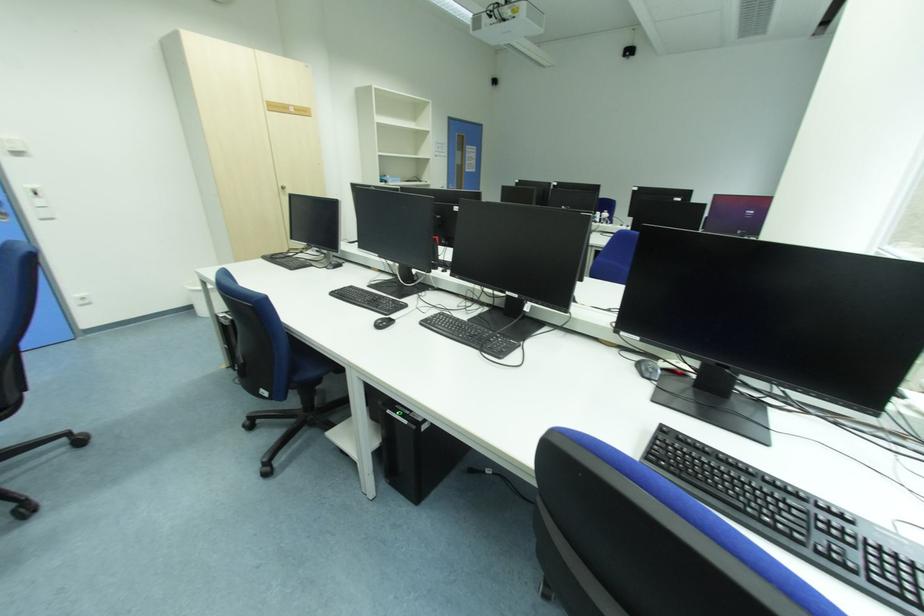
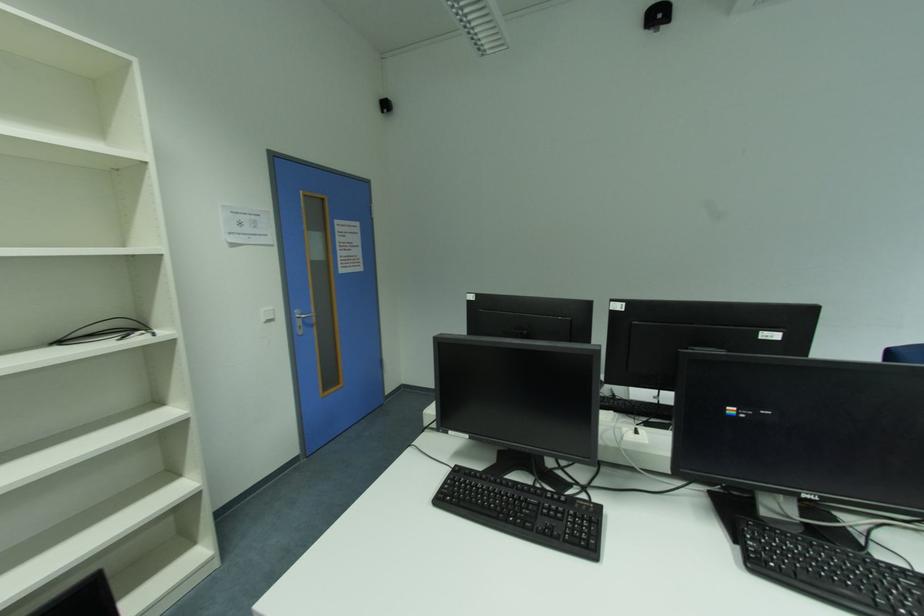
Question: The images are taken continuously from a first-person perspective. In which direction are you moving?

Choices:
 (A) Left
 (B) Right
 (C) Forward
 (D) Backward

Answer: (C)